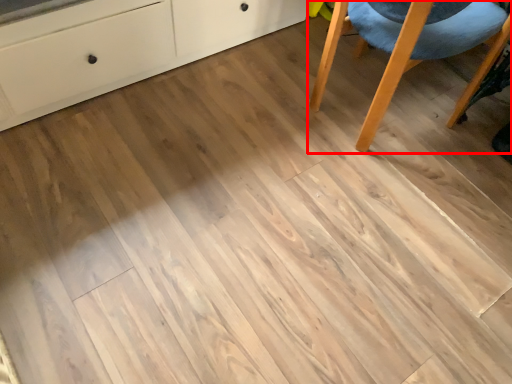
Question: From the image's perspective, considering the relative positions of chair (annotated by the red box) and chest of drawers in the image provided, where is chair (annotated by the red box) located with respect to the staircase?

Choices:
 (A) below
 (B) above

Answer: (A)